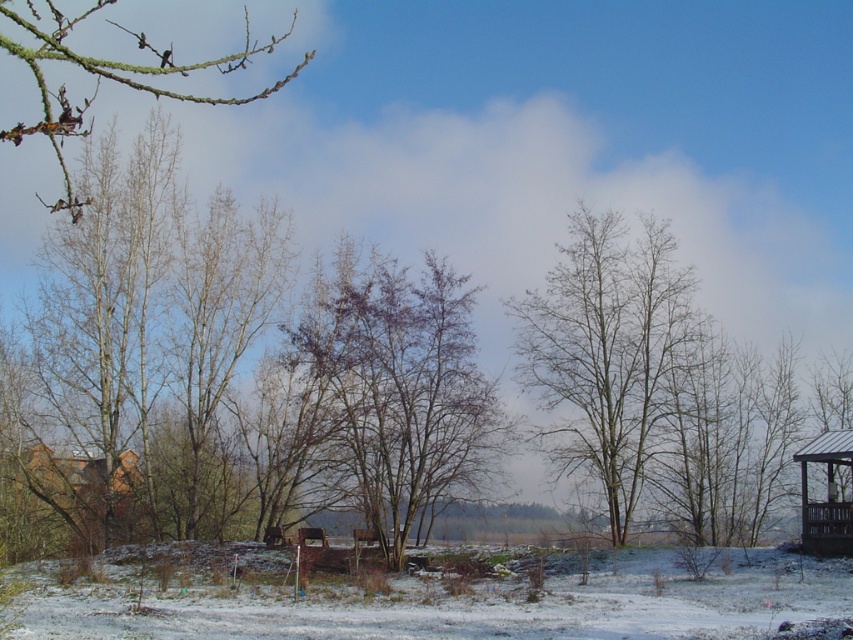
Who is lower down, green mossy branch at upper left or brown wooden gazebo at right?

brown wooden gazebo at right is lower down.

Between point (33, 10) and point (834, 490), which one is positioned in front?

Point (834, 490) is in front.

This screenshot has width=853, height=640. Identify the location of green mossy branch at upper left. (107, 77).

Find the location of `green mossy branch at upper left`. green mossy branch at upper left is located at coordinates (107, 77).

Does bare branches at center appear under brown wooden gazebo at right?

No.

Which is behind, point (636, 444) or point (840, 506)?

The point (636, 444) is more distant.

Locate an element on the screen. The height and width of the screenshot is (640, 853). bare branches at center is located at coordinates (608, 352).

Is bare branches at center below green mossy branch at upper left?

Yes.

Is bare branches at center thinner than green mossy branch at upper left?

Indeed, bare branches at center has a lesser width compared to green mossy branch at upper left.

Is point (531, 344) farther from viewer compared to point (73, 134)?

Yes, point (531, 344) is behind point (73, 134).

The image size is (853, 640). I want to click on bare branches at center, so click(x=608, y=352).